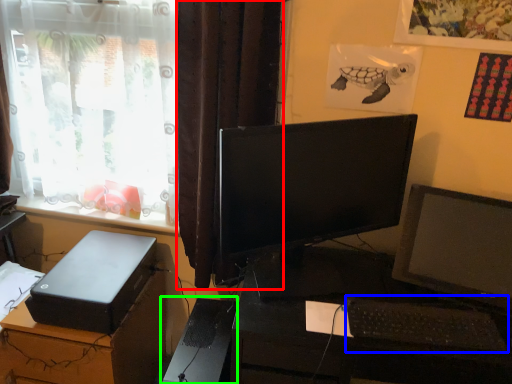
Question: Which object is positioned closest to curtain (highlighted by a red box)? Select from computer keyboard (highlighted by a blue box) and computer tower (highlighted by a green box).

Choices:
 (A) computer keyboard
 (B) computer tower

Answer: (B)